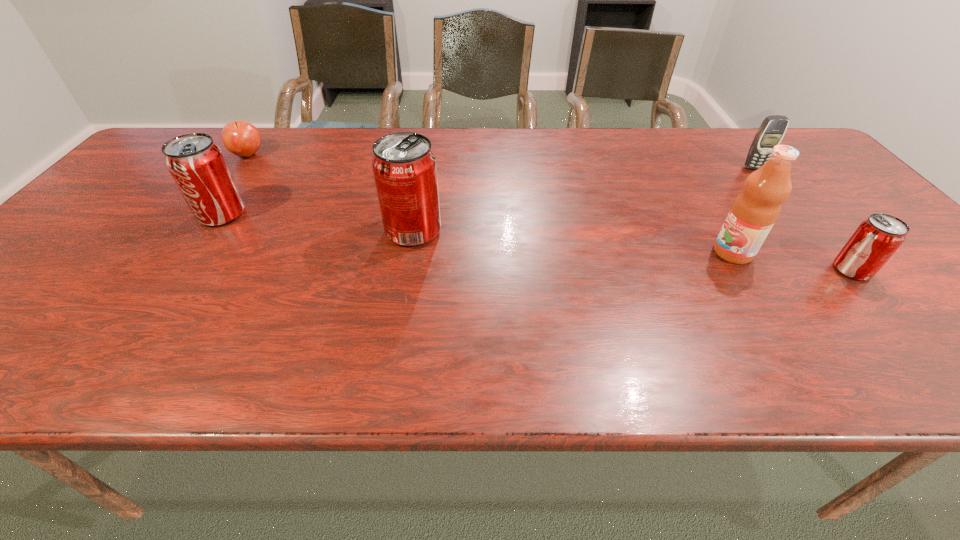
Locate an element on the screen. The image size is (960, 540). the third tallest object is located at coordinates (197, 165).

In order to click on the leftmost pop soda in this screenshot , I will do `click(197, 165)`.

Where is `the second pop soda from right to left`? The width and height of the screenshot is (960, 540). the second pop soda from right to left is located at coordinates (404, 167).

In order to click on the second shortest object in this screenshot , I will do `click(877, 238)`.

This screenshot has width=960, height=540. What are the coordinates of `the nearest pop soda` in the screenshot? It's located at (877, 238).

Locate an element on the screen. The image size is (960, 540). the shortest object is located at coordinates (241, 138).

The height and width of the screenshot is (540, 960). Find the location of `apple`. apple is located at coordinates (241, 138).

At what (x,y) coordinates should I click in order to perform the action: click on the second farthest object. Please return your answer as a coordinate pair (x, y). Looking at the image, I should click on (772, 130).

At what (x,y) coordinates should I click in order to perform the action: click on the fourth tallest object. Please return your answer as a coordinate pair (x, y). This screenshot has height=540, width=960. Looking at the image, I should click on (772, 130).

This screenshot has width=960, height=540. I want to click on the third object from right to left, so click(x=754, y=212).